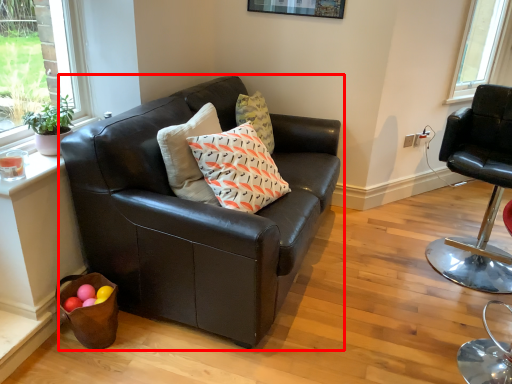
Question: From the image's perspective, where is studio couch (annotated by the red box) located relative to chair?

Choices:
 (A) above
 (B) below

Answer: (A)